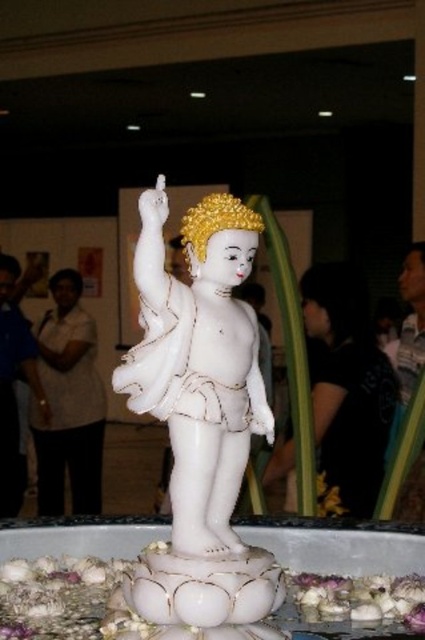
Question: Which point is farther from the camera taking this photo?

Choices:
 (A) (351, 595)
 (B) (269, 573)
 (C) (79, 294)

Answer: (C)

Question: Can you confirm if white marble statue at center is positioned below purple fabric at lower right?

Choices:
 (A) yes
 (B) no

Answer: (B)

Question: Which point is closer to the camera taking this photo?

Choices:
 (A) (399, 616)
 (B) (48, 445)

Answer: (A)

Question: Among these points, which one is nearest to the camera?

Choices:
 (A) (323, 600)
 (B) (363, 291)
 (C) (246, 618)

Answer: (C)

Question: Is white marble statue at center above black fabric at center?

Choices:
 (A) yes
 (B) no

Answer: (A)

Question: Does white marble statue at center come in front of black fabric at center?

Choices:
 (A) no
 (B) yes

Answer: (B)